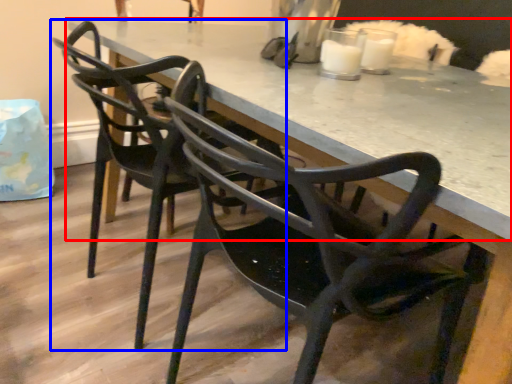
Question: Which point is further to the camera, table (highlighted by a red box) or chair (highlighted by a blue box)?

Choices:
 (A) table
 (B) chair

Answer: (B)